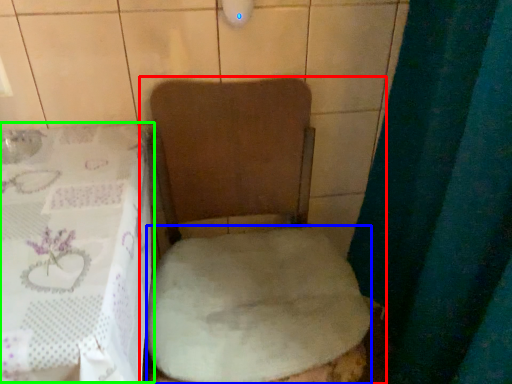
Question: Which is nearer to the toilet (highlighted by a red box)? sheet (highlighted by a blue box) or table (highlighted by a green box).

Choices:
 (A) sheet
 (B) table

Answer: (A)